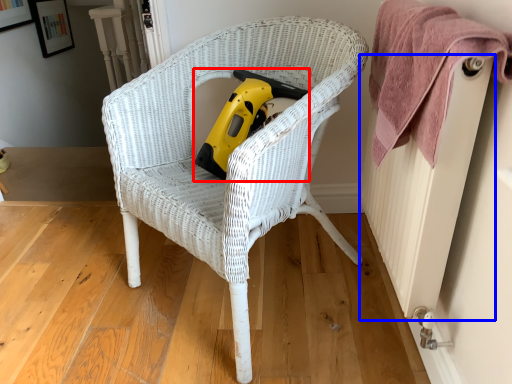
Question: Among these objects, which one is farthest to the camera, vacuum (highlighted by a red box) or radiator (highlighted by a blue box)?

Choices:
 (A) vacuum
 (B) radiator

Answer: (A)